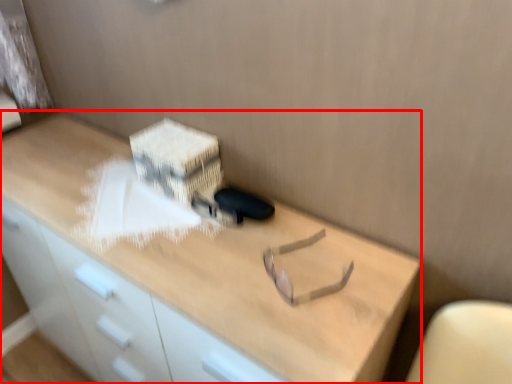
Question: Considering the relative positions of desk (annotated by the red box) and cardboard box in the image provided, where is desk (annotated by the red box) located with respect to the staircase?

Choices:
 (A) left
 (B) right

Answer: (A)